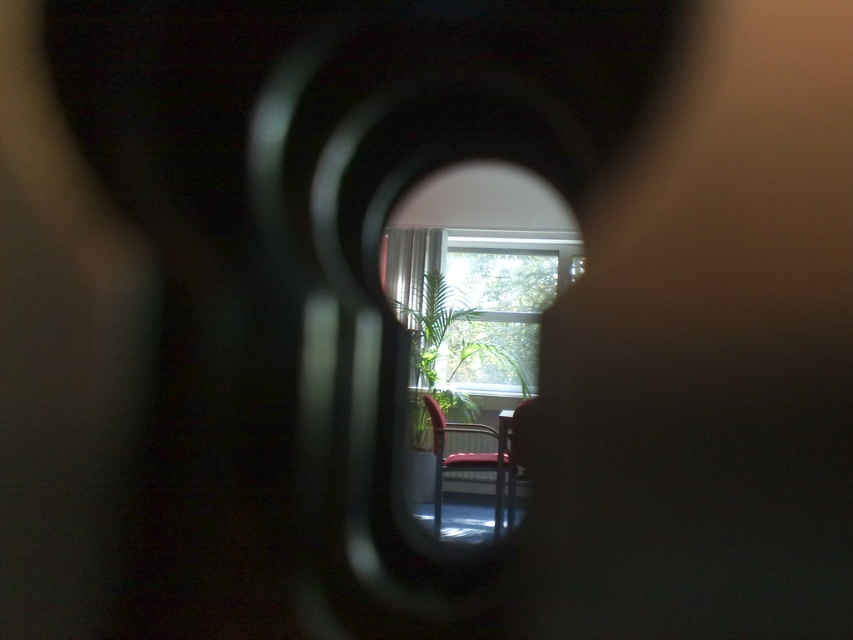
In the scene shown: You are standing in a hallway and looking through a keyhole at the scene described. You want to know how far the transparent glass window at center is from your eye level. Can you determine this distance based on the information provided?

The transparent glass window at center is 5.48 meters away from the camera, so the distance from your eye level through the keyhole would also be approximately 5.48 meters.

You are standing in front of a door with a keyhole. Through the keyhole, you can see a room with a transparent glass window at center and a metallic red chair at center. Which object is positioned to the right when viewed from your perspective?

The transparent glass window at center is to the right of the metallic red chair at center when viewed through the keyhole.

You are trying to determine if the transparent glass window at center can fit the metallic red chair at center if placed horizontally. Based on their widths, can the chair fit through the window?

The transparent glass window at center is wider than the metallic red chair at center, so the chair can fit through the window when placed horizontally.